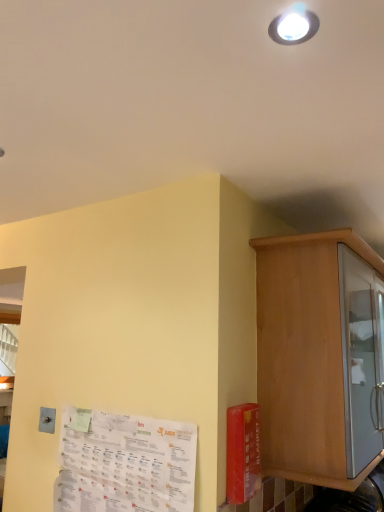
Question: Is white paper at lower left wider than wooden cabinet at right?

Choices:
 (A) yes
 (B) no

Answer: (B)

Question: Does white paper at lower left have a lesser height compared to wooden cabinet at right?

Choices:
 (A) no
 (B) yes

Answer: (B)

Question: Is white paper at lower left not inside wooden cabinet at right?

Choices:
 (A) yes
 (B) no

Answer: (A)

Question: Is wooden cabinet at right a part of white paper at lower left?

Choices:
 (A) yes
 (B) no

Answer: (B)

Question: Considering the relative sizes of white paper at lower left and wooden cabinet at right in the image provided, is white paper at lower left taller than wooden cabinet at right?

Choices:
 (A) yes
 (B) no

Answer: (B)

Question: Considering the relative sizes of white paper at lower left and wooden cabinet at right in the image provided, is white paper at lower left thinner than wooden cabinet at right?

Choices:
 (A) yes
 (B) no

Answer: (A)

Question: Is wooden cabinet at right bigger than white paper at lower left?

Choices:
 (A) no
 (B) yes

Answer: (B)

Question: Does wooden cabinet at right come behind white paper at lower left?

Choices:
 (A) no
 (B) yes

Answer: (B)

Question: Can you confirm if wooden cabinet at right is positioned to the left of white paper at lower left?

Choices:
 (A) yes
 (B) no

Answer: (B)

Question: Is wooden cabinet at right placed right next to white paper at lower left?

Choices:
 (A) no
 (B) yes

Answer: (A)

Question: Is wooden cabinet at right turned away from white paper at lower left?

Choices:
 (A) no
 (B) yes

Answer: (A)

Question: Can you confirm if wooden cabinet at right is positioned to the right of white paper at lower left?

Choices:
 (A) yes
 (B) no

Answer: (A)

Question: From a real-world perspective, is wooden cabinet at right physically located above or below white paper at lower left?

Choices:
 (A) below
 (B) above

Answer: (B)